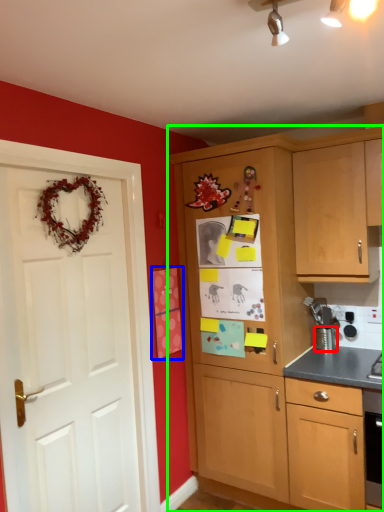
Question: Which object is positioned farthest from appliance (highlighted by a red box)? Select from postcard (highlighted by a blue box) and cabinetry (highlighted by a green box).

Choices:
 (A) postcard
 (B) cabinetry

Answer: (A)